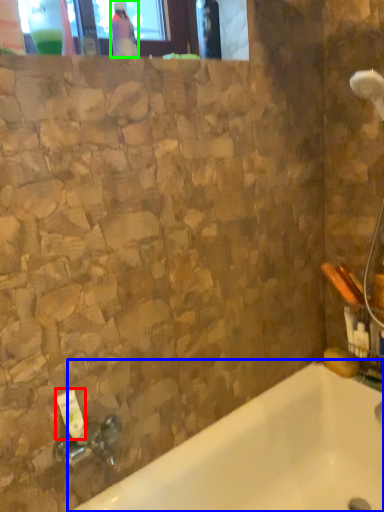
Question: Based on their relative distances, which object is farther from toiletry (highlighted by a red box)? Choose from bathtub (highlighted by a blue box) and bottle (highlighted by a green box).

Choices:
 (A) bathtub
 (B) bottle

Answer: (B)